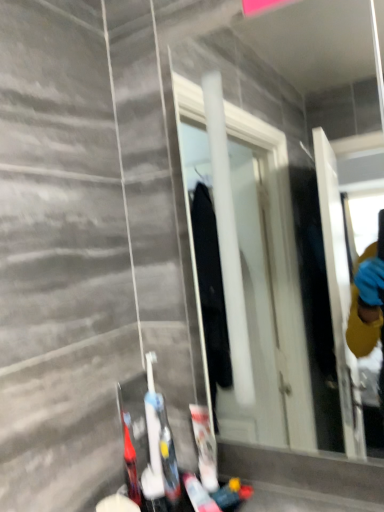
What do you see at coordinates (205, 447) in the screenshot? I see `white matte toothpaste tube at lower center, which is counted as the 1th toiletry, starting from the right` at bounding box center [205, 447].

Locate an element on the screen. This screenshot has width=384, height=512. translucent plastic toothbrush at lower left, the first toiletry positioned from the left is located at coordinates (129, 454).

Can you tell me how much translucent plastic toothbrush at lower left, the first toiletry positioned from the left, and white glossy mirror at center differ in facing direction?

The angular difference between translucent plastic toothbrush at lower left, the first toiletry positioned from the left, and white glossy mirror at center is 87 degrees.

Which of these two, translucent plastic toothbrush at lower left, the first toiletry positioned from the left, or white glossy mirror at center, is smaller?

translucent plastic toothbrush at lower left, the first toiletry positioned from the left, is smaller.

Is the depth of translucent plastic toothbrush at lower left, which is the third toiletry from right to left, less than that of white glossy mirror at center?

No.

Considering the relative positions of white matte toothpaste tube at lower center, placed as the 3th toiletry when sorted from left to right, and white glossy mirror at center in the image provided, is white matte toothpaste tube at lower center, placed as the 3th toiletry when sorted from left to right, to the right of white glossy mirror at center from the viewer's perspective?

Incorrect, white matte toothpaste tube at lower center, placed as the 3th toiletry when sorted from left to right, is not on the right side of white glossy mirror at center.

How different are the orientations of white matte toothpaste tube at lower center, which is counted as the 1th toiletry, starting from the right, and white glossy mirror at center in degrees?

There is a 18.1-degree angle between the facing directions of white matte toothpaste tube at lower center, which is counted as the 1th toiletry, starting from the right, and white glossy mirror at center.

In the scene shown: Which object is thinner, white matte toothpaste tube at lower center, which is counted as the 1th toiletry, starting from the right, or white glossy mirror at center?

white matte toothpaste tube at lower center, which is counted as the 1th toiletry, starting from the right, is thinner.

You are a GUI agent. You are given a task and a screenshot of the screen. Output one action in this format:
    pyautogui.click(x=<x>, y=<y>)
    Task: Click on the mirror positioned vertically above the white matte toothpaste tube at lower center, which is counted as the 1th toiletry, starting from the right (from a real-world perspective)
    
    Given the screenshot: What is the action you would take?
    pyautogui.click(x=272, y=252)

Based on the photo, based on their positions, is white glossy mirror at center located to the left or right of white matte toothpaste tube at lower center, placed as the 3th toiletry when sorted from left to right?

From the image, it's evident that white glossy mirror at center is to the right of white matte toothpaste tube at lower center, placed as the 3th toiletry when sorted from left to right.

Relative to white matte toothpaste tube at lower center, placed as the 3th toiletry when sorted from left to right, is white glossy mirror at center in front or behind?

Clearly, white glossy mirror at center is in front of white matte toothpaste tube at lower center, placed as the 3th toiletry when sorted from left to right.

Considering the positions of points (364, 58) and (209, 425), is point (364, 58) farther from camera compared to point (209, 425)?

Yes, it is.

From the image's perspective, which one is positioned higher, white glossy mirror at center or white matte toothpaste tube at lower center, which is counted as the 1th toiletry, starting from the right?

white glossy mirror at center, from the image's perspective.

Consider the image. From the image's perspective, which one is positioned lower, white glossy mirror at center or translucent plastic toothbrush at lower left, the first toiletry positioned from the left?

From the image's view, translucent plastic toothbrush at lower left, the first toiletry positioned from the left, is below.

Who is shorter, white glossy mirror at center or translucent plastic toothbrush at lower left, the first toiletry positioned from the left?

Standing shorter between the two is translucent plastic toothbrush at lower left, the first toiletry positioned from the left.

Looking at this image, is white glossy mirror at center at the right side of translucent plastic toothbrush at lower left, which is the third toiletry from right to left?

Yes.

The image size is (384, 512). Find the location of `toiletry behind the translucent plastic toothbrush at lower left, the first toiletry positioned from the left`. toiletry behind the translucent plastic toothbrush at lower left, the first toiletry positioned from the left is located at coordinates (205, 447).

Is white matte toothpaste tube at lower center, which is counted as the 1th toiletry, starting from the right, facing away from translucent plastic toothbrush at lower left, the first toiletry positioned from the left?

No, white matte toothpaste tube at lower center, which is counted as the 1th toiletry, starting from the right, is not facing the opposite direction of translucent plastic toothbrush at lower left, the first toiletry positioned from the left.

How many degrees apart are the facing directions of white matte toothpaste tube at lower center, which is counted as the 1th toiletry, starting from the right, and translucent plastic toothbrush at lower left, the first toiletry positioned from the left?

They differ by 68.9 degrees in their facing directions.

Which object is further away from the camera, white matte toothpaste tube at lower center, which is counted as the 1th toiletry, starting from the right, or translucent plastic toothbrush at lower left, the first toiletry positioned from the left?

white matte toothpaste tube at lower center, which is counted as the 1th toiletry, starting from the right, is behind.

Considering the sizes of white plastic toothbrush at lower center, the second toiletry in the right-to-left sequence, and translucent plastic toothbrush at lower left, which is the third toiletry from right to left, in the image, is white plastic toothbrush at lower center, the second toiletry in the right-to-left sequence, wider or thinner than translucent plastic toothbrush at lower left, which is the third toiletry from right to left,?

Clearly, white plastic toothbrush at lower center, the second toiletry in the right-to-left sequence, has more width compared to translucent plastic toothbrush at lower left, which is the third toiletry from right to left.

From the image's perspective, is white plastic toothbrush at lower center, the second toiletry from the left, over translucent plastic toothbrush at lower left, which is the third toiletry from right to left?

Yes, from the image's perspective, white plastic toothbrush at lower center, the second toiletry from the left, is over translucent plastic toothbrush at lower left, which is the third toiletry from right to left.

From a real-world perspective, which toiletry is the 1st one underneath the white plastic toothbrush at lower center, the second toiletry from the left? Please provide its 2D coordinates.

[(129, 454)]

Could you tell me if translucent plastic toothbrush at lower left, the first toiletry positioned from the left, is facing white matte toothpaste tube at lower center, which is counted as the 1th toiletry, starting from the right?

No, translucent plastic toothbrush at lower left, the first toiletry positioned from the left, is not oriented towards white matte toothpaste tube at lower center, which is counted as the 1th toiletry, starting from the right.

From the image's perspective, which is above, translucent plastic toothbrush at lower left, the first toiletry positioned from the left, or white matte toothpaste tube at lower center, placed as the 3th toiletry when sorted from left to right?

white matte toothpaste tube at lower center, placed as the 3th toiletry when sorted from left to right, appears higher in the image.

Looking at this image, does translucent plastic toothbrush at lower left, the first toiletry positioned from the left, have a smaller size compared to white matte toothpaste tube at lower center, placed as the 3th toiletry when sorted from left to right?

Indeed, translucent plastic toothbrush at lower left, the first toiletry positioned from the left, has a smaller size compared to white matte toothpaste tube at lower center, placed as the 3th toiletry when sorted from left to right.

You are a GUI agent. You are given a task and a screenshot of the screen. Output one action in this format:
    pyautogui.click(x=<x>, y=<y>)
    Task: Click on the mirror above the translucent plastic toothbrush at lower left, which is the third toiletry from right to left (from the image's perspective)
    This screenshot has height=512, width=384.
    Given the screenshot: What is the action you would take?
    pyautogui.click(x=272, y=252)

From the image's perspective, starting from the white glossy mirror at center, which toiletry is the 2nd one below? Please provide its 2D coordinates.

[(205, 447)]

Based on their spatial positions, is translucent plastic toothbrush at lower left, which is the third toiletry from right to left, or white matte toothpaste tube at lower center, placed as the 3th toiletry when sorted from left to right, further from white plastic toothbrush at lower center, the second toiletry from the left?

white matte toothpaste tube at lower center, placed as the 3th toiletry when sorted from left to right.

From the image, which object appears to be farther from white plastic toothbrush at lower center, the second toiletry in the right-to-left sequence, white matte toothpaste tube at lower center, placed as the 3th toiletry when sorted from left to right, or white glossy mirror at center?

Among the two, white glossy mirror at center is located further to white plastic toothbrush at lower center, the second toiletry in the right-to-left sequence.

Considering their positions, is white plastic toothbrush at lower center, the second toiletry from the left, positioned further to white matte toothpaste tube at lower center, placed as the 3th toiletry when sorted from left to right, than white glossy mirror at center?

Among the two, white glossy mirror at center is located further to white matte toothpaste tube at lower center, placed as the 3th toiletry when sorted from left to right.

When comparing their distances from translucent plastic toothbrush at lower left, which is the third toiletry from right to left, does white glossy mirror at center or white matte toothpaste tube at lower center, placed as the 3th toiletry when sorted from left to right, seem closer?

Among the two, white matte toothpaste tube at lower center, placed as the 3th toiletry when sorted from left to right, is located nearer to translucent plastic toothbrush at lower left, which is the third toiletry from right to left.

From the picture: From the image, which object appears to be nearer to white glossy mirror at center, translucent plastic toothbrush at lower left, the first toiletry positioned from the left, or white plastic toothbrush at lower center, the second toiletry in the right-to-left sequence?

Based on the image, white plastic toothbrush at lower center, the second toiletry in the right-to-left sequence, appears to be nearer to white glossy mirror at center.

Based on their spatial positions, is translucent plastic toothbrush at lower left, the first toiletry positioned from the left, or white glossy mirror at center further from white matte toothpaste tube at lower center, which is counted as the 1th toiletry, starting from the right?

white glossy mirror at center is further to white matte toothpaste tube at lower center, which is counted as the 1th toiletry, starting from the right.

Looking at this image, looking at the image, which one is located closer to white glossy mirror at center, white matte toothpaste tube at lower center, which is counted as the 1th toiletry, starting from the right, or white plastic toothbrush at lower center, the second toiletry in the right-to-left sequence?

white matte toothpaste tube at lower center, which is counted as the 1th toiletry, starting from the right, lies closer to white glossy mirror at center than the other object.

From the picture: Looking at the image, which one is located further to translucent plastic toothbrush at lower left, the first toiletry positioned from the left, white plastic toothbrush at lower center, the second toiletry from the left, or white glossy mirror at center?

The object further to translucent plastic toothbrush at lower left, the first toiletry positioned from the left, is white glossy mirror at center.

Where is `toiletry between white glossy mirror at center and white matte toothpaste tube at lower center, which is counted as the 1th toiletry, starting from the right, in the vertical direction`? The width and height of the screenshot is (384, 512). toiletry between white glossy mirror at center and white matte toothpaste tube at lower center, which is counted as the 1th toiletry, starting from the right, in the vertical direction is located at coordinates (168, 457).

Find the location of a particular element. Image resolution: width=384 pixels, height=512 pixels. toiletry between translucent plastic toothbrush at lower left, the first toiletry positioned from the left, and white matte toothpaste tube at lower center, which is counted as the 1th toiletry, starting from the right, in the horizontal direction is located at coordinates (168, 457).